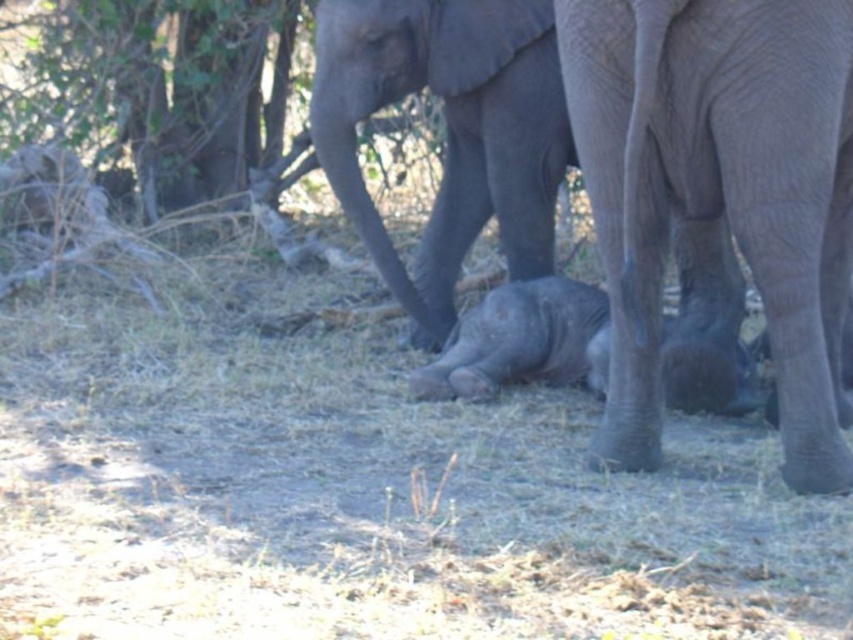
Question: Which of the following is the closest to the observer?

Choices:
 (A) (459, 244)
 (B) (140, 147)
 (C) (461, 333)

Answer: (C)

Question: Is dry grass at center wider than green leafy tree at upper left?

Choices:
 (A) no
 (B) yes

Answer: (B)

Question: Among these points, which one is farthest from the camera?

Choices:
 (A) (273, 440)
 (B) (447, 88)
 (C) (627, 452)
 (D) (228, 150)

Answer: (D)

Question: Which of the following is the closest to the observer?

Choices:
 (A) (242, 58)
 (B) (509, 310)

Answer: (B)

Question: Can you confirm if gray textured elephant at center is wider than gray matte elephant at center?

Choices:
 (A) yes
 (B) no

Answer: (B)

Question: Is dry grass at center to the right of gray matte baby elephant at center from the viewer's perspective?

Choices:
 (A) yes
 (B) no

Answer: (B)